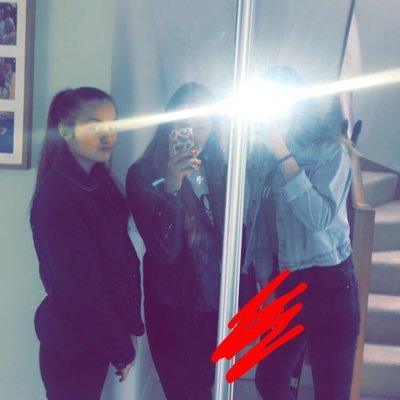
You are a GUI agent. You are given a task and a screenshot of the screen. Output one action in this format:
    pyautogui.click(x=<x>, y=<y>)
    Task: Click on the wall
    This screenshot has width=400, height=400.
    Given the screenshot: What is the action you would take?
    pyautogui.click(x=25, y=310)